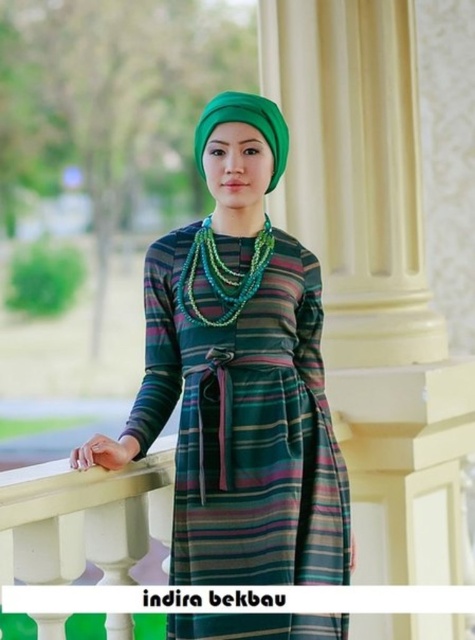
Is white painted wood at center behind green felt hat at upper center?

That is False.

Between white painted wood at center and green felt hat at upper center, which one is positioned lower?

white painted wood at center is below.

Where is `white painted wood at center`? The height and width of the screenshot is (640, 475). white painted wood at center is located at coordinates (401, 490).

How distant is striped fabric dress at center from green beaded necklace at center?

striped fabric dress at center is 9.52 inches from green beaded necklace at center.

Which is more to the right, striped fabric dress at center or green beaded necklace at center?

From the viewer's perspective, striped fabric dress at center appears more on the right side.

Is point (237, 451) closer to viewer compared to point (220, 282)?

That is True.

Find the location of `striped fabric dress at center`. striped fabric dress at center is located at coordinates (246, 426).

Is striped fabric dress at center above white painted wood at center?

Yes.

Measure the distance from striped fabric dress at center to white painted wood at center.

A distance of 19.08 inches exists between striped fabric dress at center and white painted wood at center.

The width and height of the screenshot is (475, 640). In order to click on striped fabric dress at center in this screenshot , I will do pyautogui.click(x=246, y=426).